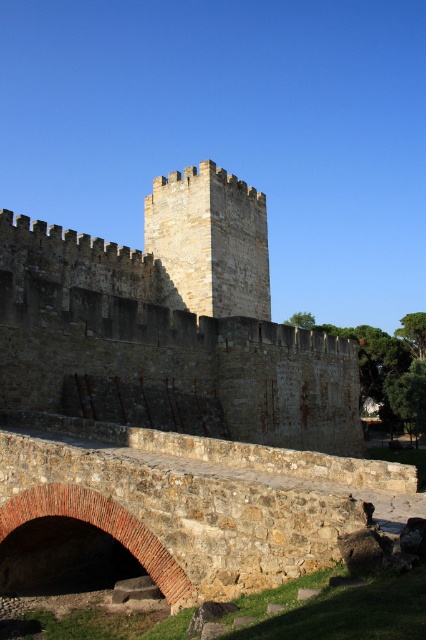
Question: Which object is farther from the camera taking this photo?

Choices:
 (A) stone tower at center
 (B) stone textured tower at center
 (C) brick archway at lower left

Answer: (B)

Question: Can you confirm if stone tower at center is positioned below brick archway at lower left?

Choices:
 (A) no
 (B) yes

Answer: (A)

Question: Is stone tower at center above stone textured tower at center?

Choices:
 (A) no
 (B) yes

Answer: (A)

Question: Which of these objects is positioned closest to the stone textured tower at center?

Choices:
 (A) brick archway at lower left
 (B) stone tower at center

Answer: (B)

Question: Estimate the real-world distances between objects in this image. Which object is closer to the brick archway at lower left?

Choices:
 (A) stone tower at center
 (B) stone textured tower at center

Answer: (A)

Question: Is stone textured tower at center in front of brick archway at lower left?

Choices:
 (A) yes
 (B) no

Answer: (B)